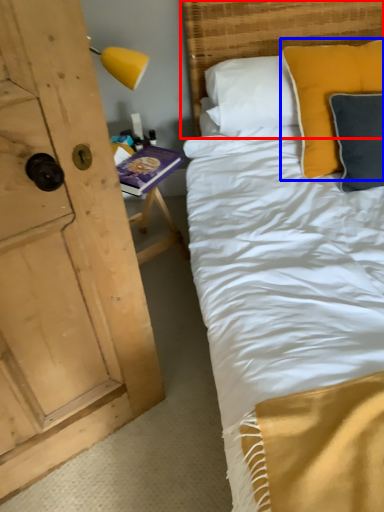
Question: Which object is closer to the camera taking this photo, headboard (highlighted by a red box) or pillow (highlighted by a blue box)?

Choices:
 (A) headboard
 (B) pillow

Answer: (B)